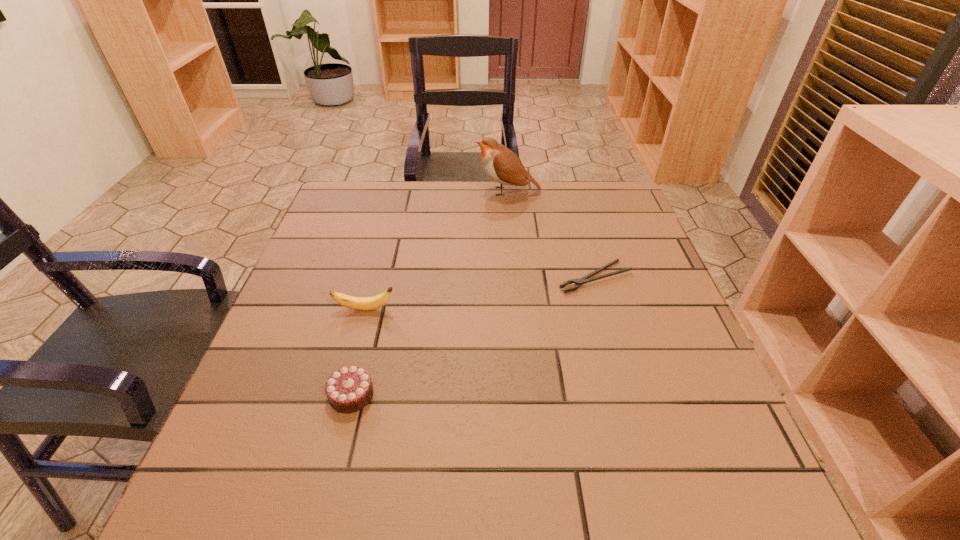
Locate an element on the screen. This screenshot has height=540, width=960. vacant region that satisfies the following two spatial constraints: 1. at the stem of the third farthest object; 2. on the right side of the third tallest object is located at coordinates (343, 394).

Identify the location of free location that satisfies the following two spatial constraints: 1. on the back side of the nearest object; 2. at the stem of the third shortest object. The image size is (960, 540). (373, 309).